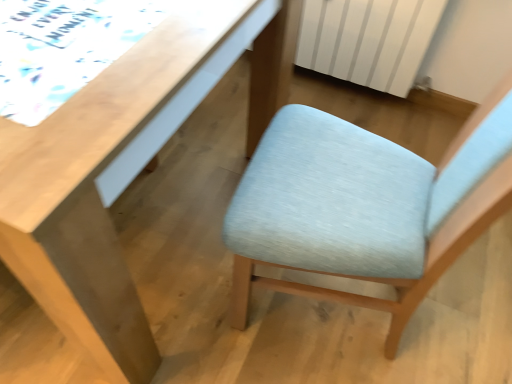
Where is `light wood desk at upper left`? light wood desk at upper left is located at coordinates (96, 192).

This screenshot has width=512, height=384. Describe the element at coordinates (364, 207) in the screenshot. I see `light blue fabric chair at center` at that location.

From the picture: What is the approximate height of white striped radiator at upper right?

It is 49.41 centimeters.

The image size is (512, 384). In order to click on light wood desk at upper left in this screenshot , I will do `click(96, 192)`.

Considering the sizes of objects light wood desk at upper left and light blue fabric chair at center in the image provided, who is bigger, light wood desk at upper left or light blue fabric chair at center?

light wood desk at upper left is bigger.

Considering the relative positions of light wood desk at upper left and light blue fabric chair at center in the image provided, is light wood desk at upper left in front of light blue fabric chair at center?

No, it is not.

The height and width of the screenshot is (384, 512). I want to click on desk behind the light blue fabric chair at center, so click(96, 192).

Which point is more distant from viewer, (252,130) or (390,215)?

The point (252,130) is behind.

From the image's perspective, is light blue fabric chair at center above white striped radiator at upper right?

No, from the image's perspective, light blue fabric chair at center is not above white striped radiator at upper right.

How different are the orientations of light blue fabric chair at center and white striped radiator at upper right in degrees?

The angle between the facing direction of light blue fabric chair at center and the facing direction of white striped radiator at upper right is 92.3 degrees.

In the image, is light blue fabric chair at center positioned in front of or behind white striped radiator at upper right?

Clearly, light blue fabric chair at center is in front of white striped radiator at upper right.

Is light blue fabric chair at center at the right side of white striped radiator at upper right?

In fact, light blue fabric chair at center is to the left of white striped radiator at upper right.

Is white striped radiator at upper right in contact with light blue fabric chair at center?

They are not placed beside each other.

From the image's perspective, between white striped radiator at upper right and light blue fabric chair at center, which one is located above?

white striped radiator at upper right.

Which of these two, white striped radiator at upper right or light blue fabric chair at center, is thinner?

white striped radiator at upper right is thinner.

From a real-world perspective, does white striped radiator at upper right sit lower than light blue fabric chair at center?

Correct, in the physical world, white striped radiator at upper right is lower than light blue fabric chair at center.

Looking at this image, between light wood desk at upper left and white striped radiator at upper right, which one appears on the left side from the viewer's perspective?

light wood desk at upper left.

Find the location of a particular element. Image resolution: width=512 pixels, height=384 pixels. desk on the left side of white striped radiator at upper right is located at coordinates (96, 192).

Considering the points (145, 355) and (368, 73), which point is behind, point (145, 355) or point (368, 73)?

The point (368, 73) is farther.

From the image's perspective, is light wood desk at upper left above or below white striped radiator at upper right?

light wood desk at upper left is below white striped radiator at upper right.

Considering their positions, is white striped radiator at upper right located in front of or behind light wood desk at upper left?

white striped radiator at upper right is positioned farther from the viewer than light wood desk at upper left.

Is white striped radiator at upper right positioned with its back to light wood desk at upper left?

No, white striped radiator at upper right is not facing away from light wood desk at upper left.

Considering the relative positions of white striped radiator at upper right and light wood desk at upper left in the image provided, is white striped radiator at upper right to the right of light wood desk at upper left from the viewer's perspective?

Correct, you'll find white striped radiator at upper right to the right of light wood desk at upper left.

Considering the sizes of white striped radiator at upper right and light wood desk at upper left in the image, is white striped radiator at upper right bigger or smaller than light wood desk at upper left?

white striped radiator at upper right is smaller than light wood desk at upper left.

Who is more distant, light blue fabric chair at center or light wood desk at upper left?

light wood desk at upper left is further from the camera.

From the picture: From the image's perspective, is light blue fabric chair at center located beneath light wood desk at upper left?

Correct, light blue fabric chair at center appears lower than light wood desk at upper left in the image.

In the image, is light blue fabric chair at center on the left side or the right side of light wood desk at upper left?

In the image, light blue fabric chair at center appears on the right side of light wood desk at upper left.

Is light blue fabric chair at center shorter than light wood desk at upper left?

Incorrect, the height of light blue fabric chair at center does not fall short of that of light wood desk at upper left.

Where is `chair in front of the light wood desk at upper left`? The height and width of the screenshot is (384, 512). chair in front of the light wood desk at upper left is located at coordinates (364, 207).

Locate an element on the screen. chair located on the left of white striped radiator at upper right is located at coordinates (364, 207).

When comparing their distances from white striped radiator at upper right, does light blue fabric chair at center or light wood desk at upper left seem closer?

The object closer to white striped radiator at upper right is light blue fabric chair at center.

Estimate the real-world distances between objects in this image. Which object is further from white striped radiator at upper right, light wood desk at upper left or light blue fabric chair at center?

light wood desk at upper left is positioned further to the anchor white striped radiator at upper right.

Looking at the image, which one is located closer to light blue fabric chair at center, white striped radiator at upper right or light wood desk at upper left?

light wood desk at upper left is positioned closer to the anchor light blue fabric chair at center.

Looking at the image, which one is located closer to light wood desk at upper left, light blue fabric chair at center or white striped radiator at upper right?

light blue fabric chair at center.

From the image, which object appears to be farther from light wood desk at upper left, white striped radiator at upper right or light blue fabric chair at center?

Among the two, white striped radiator at upper right is located further to light wood desk at upper left.

Estimate the real-world distances between objects in this image. Which object is closer to light blue fabric chair at center, light wood desk at upper left or white striped radiator at upper right?

Among the two, light wood desk at upper left is located nearer to light blue fabric chair at center.

Find the location of a particular element. desk positioned between light blue fabric chair at center and white striped radiator at upper right from near to far is located at coordinates (96, 192).